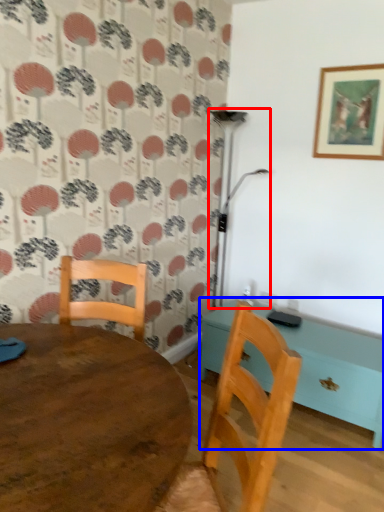
Question: Which object appears closest to the camera in this image, lamp (highlighted by a red box) or table (highlighted by a blue box)?

Choices:
 (A) lamp
 (B) table

Answer: (B)